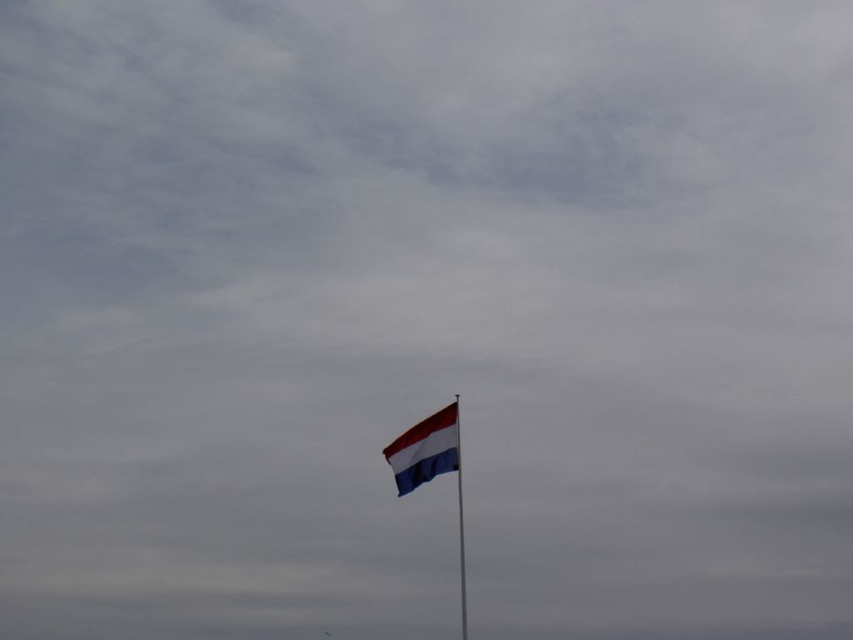
You are a photographer trying to capture the flagpole and flag in the scene. You want to ensure that the flag appears wider than the pole in your photo. Based on the scene description, will the striped fabric flag at center naturally appear wider than the metallic flag pole at center in the image?

Yes, the striped fabric flag at center naturally appears wider than the metallic flag pole at center because its width surpasses that of the pole.

You are standing in front of the flagpole and want to determine the relative positions of two points on the flag. The points are labeled as point (393,444) and point (460,605). Which point is closer to you?

Point (393,444) is closer to the viewer than point (460,605).